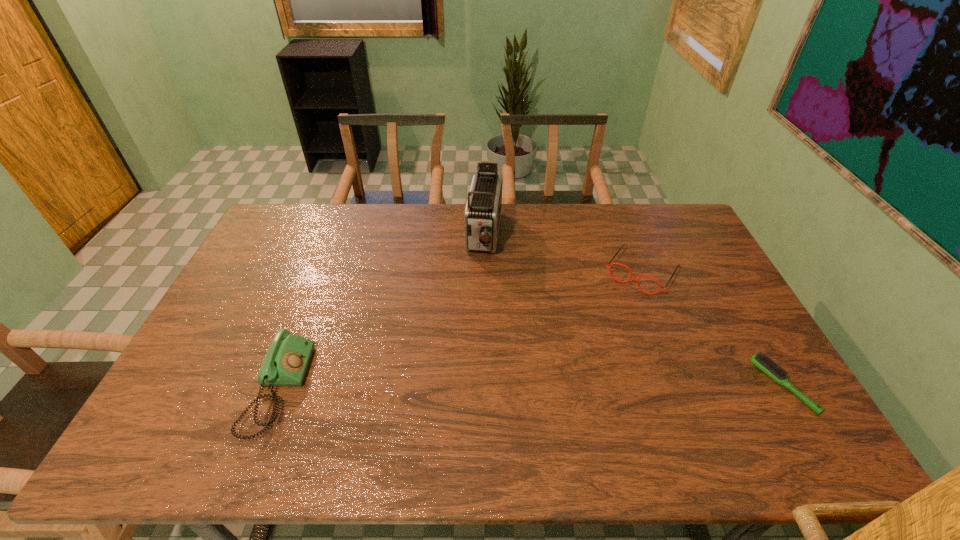
Locate an element on the screen. The width and height of the screenshot is (960, 540). spectacles positioned at the right edge is located at coordinates [631, 277].

Identify the location of object that is at the near right corner. (763, 362).

Find the location of a particular element. The height and width of the screenshot is (540, 960). vacant space at the far edge is located at coordinates (554, 212).

Image resolution: width=960 pixels, height=540 pixels. In the image, there is a desktop. Find the location of `free space at the near edge`. free space at the near edge is located at coordinates (682, 414).

At what (x,y) coordinates should I click in order to perform the action: click on vacant region at the left edge of the desktop. Please return your answer as a coordinate pair (x, y). Looking at the image, I should click on (240, 303).

In order to click on vacant space at the right edge of the desktop in this screenshot , I will do `click(757, 350)`.

The height and width of the screenshot is (540, 960). What are the coordinates of `free location at the far right corner of the desktop` in the screenshot? It's located at (682, 209).

This screenshot has width=960, height=540. I want to click on free space between the spectacles and the rightmost object, so click(712, 329).

Where is `free space between the camcorder and the leftmost object`? The height and width of the screenshot is (540, 960). free space between the camcorder and the leftmost object is located at coordinates (381, 313).

Where is `unoccupied area between the rightmost object and the second object from right to left`? This screenshot has height=540, width=960. unoccupied area between the rightmost object and the second object from right to left is located at coordinates (712, 329).